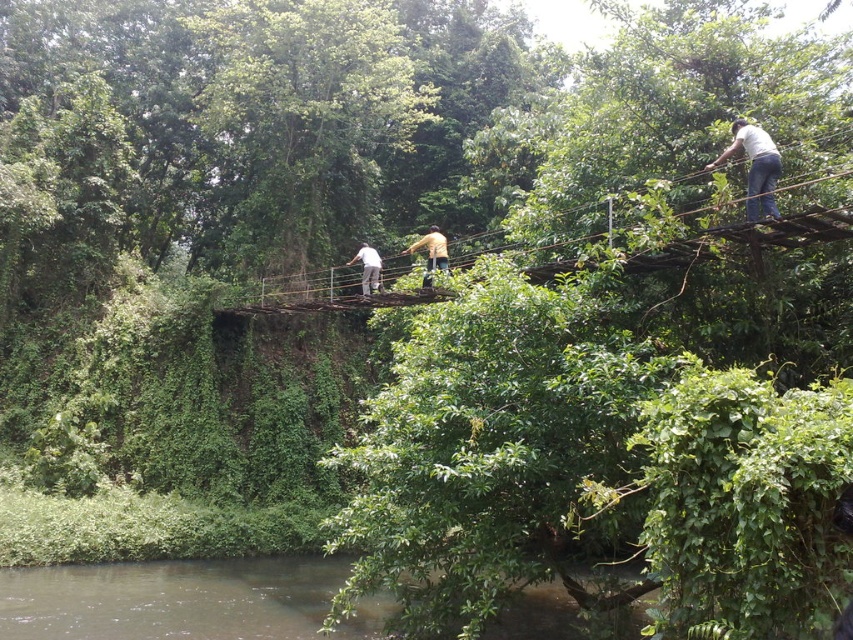
Question: Is brown murky water at lower left positioned behind yellow fabric shirt at center?

Choices:
 (A) yes
 (B) no

Answer: (B)

Question: Which of the following is the farthest from the observer?

Choices:
 (A) (427, 285)
 (B) (349, 300)
 (C) (242, 566)

Answer: (C)

Question: Is the position of brown murky water at lower left less distant than that of white cotton shirt at upper right?

Choices:
 (A) no
 (B) yes

Answer: (A)

Question: Which point appears closest to the camera in this image?

Choices:
 (A) (393, 301)
 (B) (440, 250)
 (C) (370, 278)
 (D) (544, 634)

Answer: (D)

Question: Is brown wooden bridge at center below white cotton shirt at upper right?

Choices:
 (A) no
 (B) yes

Answer: (B)

Question: Which point appears farthest from the camera in this image?

Choices:
 (A) (248, 308)
 (B) (375, 259)
 (C) (767, 147)
 (D) (252, 605)

Answer: (A)